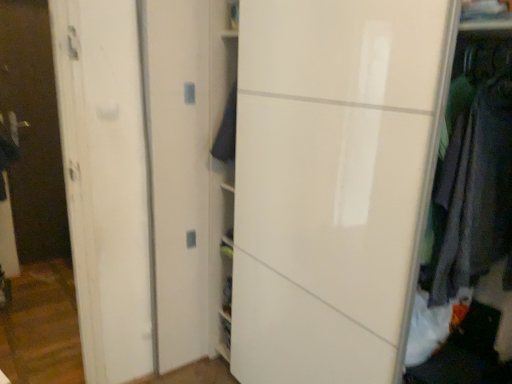
You are a GUI agent. You are given a task and a screenshot of the screen. Output one action in this format:
    pyautogui.click(x=<x>, y=<y>)
    Task: Click on the transparent glass door at left
    
    Given the screenshot: What is the action you would take?
    pyautogui.click(x=33, y=131)

Where is `dark blue fabric at center, the second clothing viewed from the right`? Image resolution: width=512 pixels, height=384 pixels. dark blue fabric at center, the second clothing viewed from the right is located at coordinates (227, 131).

How much space does dark gray fabric at right, which appears as the 2th clothing when viewed from the back, occupy horizontally?

It is 17.73 inches.

Locate an element on the screen. transparent glass door at left is located at coordinates (33, 131).

Does transparent glass door at left turn towards dark gray fabric at right, marked as the 1th clothing in a right-to-left arrangement?

No, transparent glass door at left is not oriented towards dark gray fabric at right, marked as the 1th clothing in a right-to-left arrangement.

Is transparent glass door at left wider than dark gray fabric at right, which is the 2th clothing from left to right?

Incorrect, the width of transparent glass door at left does not surpass that of dark gray fabric at right, which is the 2th clothing from left to right.

Who is shorter, transparent glass door at left or dark gray fabric at right, which is the 2th clothing from left to right?

dark gray fabric at right, which is the 2th clothing from left to right, is shorter.

Does point (24, 62) lie in front of point (468, 122)?

No, it is behind (468, 122).

Is dark blue fabric at center, the second clothing when ordered from front to back, in front of or behind dark gray fabric at right, which appears as the 2th clothing when viewed from the back, in the image?

Clearly, dark blue fabric at center, the second clothing when ordered from front to back, is behind dark gray fabric at right, which appears as the 2th clothing when viewed from the back.

From the image's perspective, is dark blue fabric at center, which is the 1th clothing from back to front, above dark gray fabric at right, which is the 2th clothing from left to right?

→ Yes, from the image's perspective, dark blue fabric at center, which is the 1th clothing from back to front, is over dark gray fabric at right, which is the 2th clothing from left to right.

Where is `clothing on the right of dark blue fabric at center, which ranks as the 1th clothing in left-to-right order`? Image resolution: width=512 pixels, height=384 pixels. clothing on the right of dark blue fabric at center, which ranks as the 1th clothing in left-to-right order is located at coordinates (476, 193).

Do you think dark gray fabric at right, which appears as the 1th clothing when viewed from the front, is within transparent glass door at left, or outside of it?

dark gray fabric at right, which appears as the 1th clothing when viewed from the front, is spatially situated outside transparent glass door at left.

Considering the relative sizes of dark gray fabric at right, which is the 2th clothing from left to right, and transparent glass door at left in the image provided, is dark gray fabric at right, which is the 2th clothing from left to right, thinner than transparent glass door at left?

In fact, dark gray fabric at right, which is the 2th clothing from left to right, might be wider than transparent glass door at left.

From the image's perspective, between dark gray fabric at right, which appears as the 1th clothing when viewed from the front, and transparent glass door at left, who is located below?

From the image's view, dark gray fabric at right, which appears as the 1th clothing when viewed from the front, is below.

Consider the image. How much distance is there between dark gray fabric at right, which appears as the 2th clothing when viewed from the back, and transparent glass door at left?

2.93 meters.

Considering the relative sizes of dark blue fabric at center, the second clothing when ordered from front to back, and transparent glass door at left in the image provided, is dark blue fabric at center, the second clothing when ordered from front to back, bigger than transparent glass door at left?

Incorrect, dark blue fabric at center, the second clothing when ordered from front to back, is not larger than transparent glass door at left.

Can you confirm if dark blue fabric at center, which ranks as the 1th clothing in left-to-right order, is taller than transparent glass door at left?

In fact, dark blue fabric at center, which ranks as the 1th clothing in left-to-right order, may be shorter than transparent glass door at left.

From the picture: Which of these two, dark blue fabric at center, which is the 1th clothing from back to front, or transparent glass door at left, is wider?

With larger width is dark blue fabric at center, which is the 1th clothing from back to front.

Is dark blue fabric at center, the second clothing viewed from the right, in contact with transparent glass door at left?

No, dark blue fabric at center, the second clothing viewed from the right, is not with transparent glass door at left.

Is transparent glass door at left oriented away from dark blue fabric at center, which ranks as the 1th clothing in left-to-right order?

No, transparent glass door at left is not facing the opposite direction of dark blue fabric at center, which ranks as the 1th clothing in left-to-right order.

From the image's perspective, between transparent glass door at left and dark blue fabric at center, the second clothing viewed from the right, who is located below?

dark blue fabric at center, the second clothing viewed from the right, appears lower in the image.

Is transparent glass door at left further to camera compared to dark blue fabric at center, the second clothing viewed from the right?

Yes, transparent glass door at left is behind dark blue fabric at center, the second clothing viewed from the right.

The height and width of the screenshot is (384, 512). What are the coordinates of `glass door below the dark blue fabric at center, the second clothing when ordered from front to back (from a real-world perspective)` in the screenshot? It's located at (33, 131).

Considering the sizes of objects dark gray fabric at right, which is the 2th clothing from left to right, and dark blue fabric at center, the second clothing when ordered from front to back, in the image provided, who is shorter, dark gray fabric at right, which is the 2th clothing from left to right, or dark blue fabric at center, the second clothing when ordered from front to back,?

Standing shorter between the two is dark blue fabric at center, the second clothing when ordered from front to back.

Is dark gray fabric at right, which appears as the 2th clothing when viewed from the back, thinner than dark blue fabric at center, which is the 1th clothing from back to front?

Incorrect, the width of dark gray fabric at right, which appears as the 2th clothing when viewed from the back, is not less than that of dark blue fabric at center, which is the 1th clothing from back to front.

Is dark gray fabric at right, which appears as the 1th clothing when viewed from the front, far away from dark blue fabric at center, the second clothing when ordered from front to back?

dark gray fabric at right, which appears as the 1th clothing when viewed from the front, is near dark blue fabric at center, the second clothing when ordered from front to back, not far away.

The width and height of the screenshot is (512, 384). What are the coordinates of `the 2nd clothing to the right of the transparent glass door at left, counting from the anchor's position` in the screenshot? It's located at (476, 193).

You are a GUI agent. You are given a task and a screenshot of the screen. Output one action in this format:
    pyautogui.click(x=<x>, y=<y>)
    Task: Click on the clothing that is under the dark blue fabric at center, the second clothing viewed from the right (from a real-world perspective)
    
    Given the screenshot: What is the action you would take?
    click(476, 193)

When comparing their distances from dark gray fabric at right, which appears as the 2th clothing when viewed from the back, does dark blue fabric at center, the second clothing viewed from the right, or transparent glass door at left seem further?

The object further to dark gray fabric at right, which appears as the 2th clothing when viewed from the back, is transparent glass door at left.

Which object lies nearer to the anchor point dark blue fabric at center, the second clothing viewed from the right, transparent glass door at left or dark gray fabric at right, which appears as the 2th clothing when viewed from the back?

The object closer to dark blue fabric at center, the second clothing viewed from the right, is dark gray fabric at right, which appears as the 2th clothing when viewed from the back.

Which object lies nearer to the anchor point dark blue fabric at center, the second clothing when ordered from front to back, dark gray fabric at right, which is the 2th clothing from left to right, or transparent glass door at left?

dark gray fabric at right, which is the 2th clothing from left to right, lies closer to dark blue fabric at center, the second clothing when ordered from front to back, than the other object.

Based on their spatial positions, is dark blue fabric at center, which ranks as the 1th clothing in left-to-right order, or dark gray fabric at right, which appears as the 1th clothing when viewed from the front, further from transparent glass door at left?

dark gray fabric at right, which appears as the 1th clothing when viewed from the front.

Based on their spatial positions, is dark gray fabric at right, which is the 2th clothing from left to right, or dark blue fabric at center, the second clothing viewed from the right, further from transparent glass door at left?

The object further to transparent glass door at left is dark gray fabric at right, which is the 2th clothing from left to right.

Considering their positions, is transparent glass door at left positioned further to dark gray fabric at right, which appears as the 1th clothing when viewed from the front, than dark blue fabric at center, the second clothing when ordered from front to back?

The object further to dark gray fabric at right, which appears as the 1th clothing when viewed from the front, is transparent glass door at left.

You are a GUI agent. You are given a task and a screenshot of the screen. Output one action in this format:
    pyautogui.click(x=<x>, y=<y>)
    Task: Click on the clothing situated between transparent glass door at left and dark gray fabric at right, which appears as the 2th clothing when viewed from the back, from left to right
    
    Given the screenshot: What is the action you would take?
    pyautogui.click(x=227, y=131)